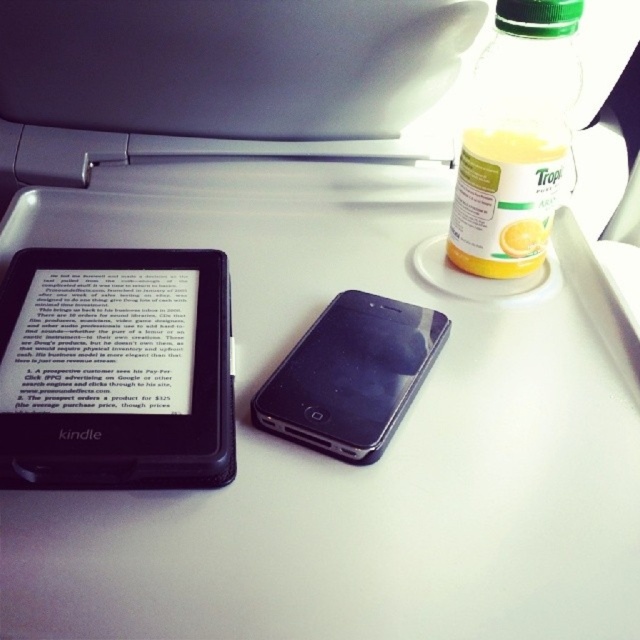
Question: Is black matte/ipad at center below translucent plastic bottle of orange juice at upper right?

Choices:
 (A) no
 (B) yes

Answer: (B)

Question: Is translucent plastic bottle at upper right below translucent plastic bottle of orange juice at upper right?

Choices:
 (A) yes
 (B) no

Answer: (B)

Question: Which object appears closest to the camera in this image?

Choices:
 (A) translucent plastic bottle of orange juice at upper right
 (B) black matte/ipad at center

Answer: (B)

Question: Which point is farther to the camera?

Choices:
 (A) (22, 628)
 (B) (515, 248)

Answer: (B)

Question: Which point appears farthest from the camera in this image?

Choices:
 (A) (499, 189)
 (B) (572, 36)
 (C) (332, 435)
 (D) (166, 268)

Answer: (A)

Question: Can you confirm if translucent plastic bottle at upper right is wider than black matte/ipad at center?

Choices:
 (A) no
 (B) yes

Answer: (B)